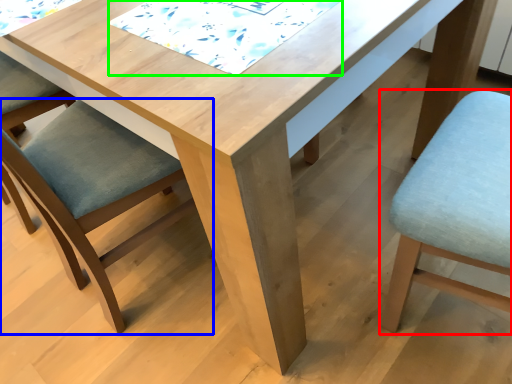
Question: Which object is the farthest from chair (highlighted by a red box)? Choose among these: chair (highlighted by a blue box) or quilt (highlighted by a green box).

Choices:
 (A) chair
 (B) quilt

Answer: (A)